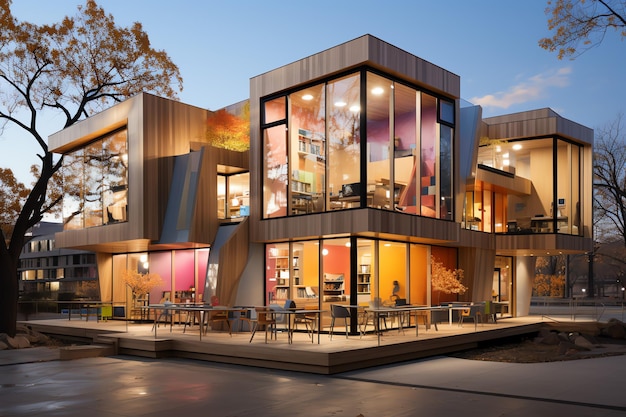
The width and height of the screenshot is (626, 417). What are the coordinates of `second story floor` in the screenshot? It's located at (104, 215), (243, 193), (334, 186), (504, 201), (578, 187).